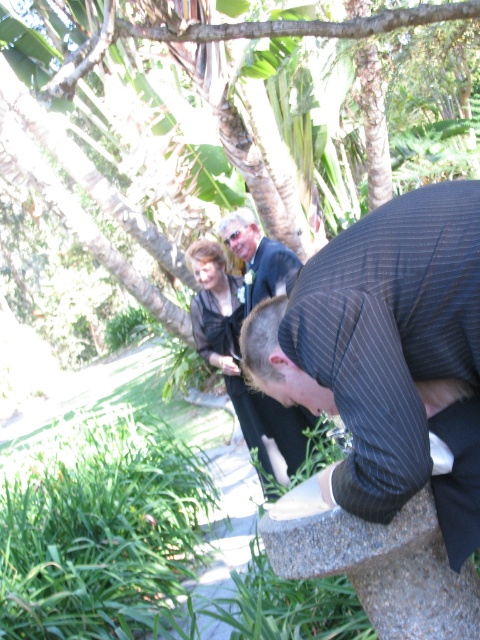
Does green leafy tree at upper center come behind dark gray fabric dress at center?

No, green leafy tree at upper center is in front of dark gray fabric dress at center.

Between green leafy tree at upper center and dark gray fabric dress at center, which one appears on the left side from the viewer's perspective?

green leafy tree at upper center is more to the left.

Between point (110, 266) and point (284, 429), which one is positioned in front?

Point (284, 429) is more forward.

Locate an element on the screen. green leafy tree at upper center is located at coordinates click(x=192, y=83).

Which is above, dark pinstripe suit at center or green leafy tree at upper center?

green leafy tree at upper center is higher up.

Is dark pinstripe suit at center taller than green leafy tree at upper center?

No.

Who is more distant from viewer, (440,356) or (139,214)?

Point (139,214)

Locate an element on the screen. This screenshot has height=640, width=480. dark pinstripe suit at center is located at coordinates (386, 353).

Which is more to the right, dark pinstripe suit at center or dark gray fabric dress at center?

dark pinstripe suit at center is more to the right.

The width and height of the screenshot is (480, 640). What do you see at coordinates (386, 353) in the screenshot? I see `dark pinstripe suit at center` at bounding box center [386, 353].

Does point (399, 444) come behind point (240, 316)?

No, (399, 444) is in front of (240, 316).

At what (x,y) coordinates should I click in order to perform the action: click on dark pinstripe suit at center. Please return your answer as a coordinate pair (x, y). Looking at the image, I should click on (386, 353).